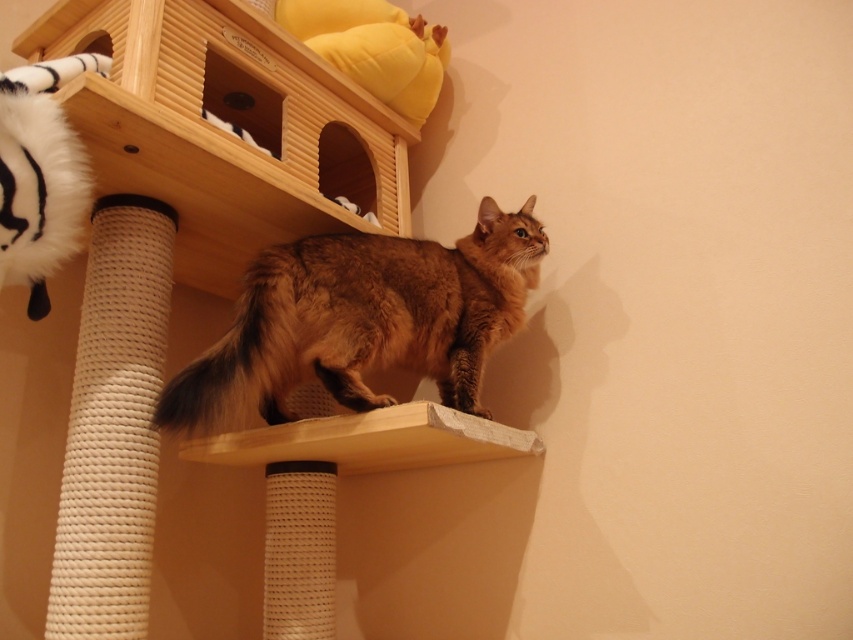
Question: Which object is closer to the camera taking this photo?

Choices:
 (A) brown fur at upper center
 (B) white textured rope at lower center
 (C) light wood/rough surface ledge at center
 (D) brown furry cat at center

Answer: (A)

Question: Does light wood/texture shelf at upper center have a lesser width compared to light wood/rough surface ledge at center?

Choices:
 (A) yes
 (B) no

Answer: (B)

Question: Is brown furry cat at center thinner than white textured scratching post at left?

Choices:
 (A) yes
 (B) no

Answer: (B)

Question: Considering the real-world distances, which object is farthest from the brown fur at upper center?

Choices:
 (A) brown furry cat at center
 (B) white textured scratching post at left

Answer: (B)

Question: Which point appears closest to the camera in this image?

Choices:
 (A) 309,304
 (B) 289,372
 (C) 206,64

Answer: (A)

Question: Is light wood/texture shelf at upper center to the right of light wood/rough surface ledge at center from the viewer's perspective?

Choices:
 (A) yes
 (B) no

Answer: (B)